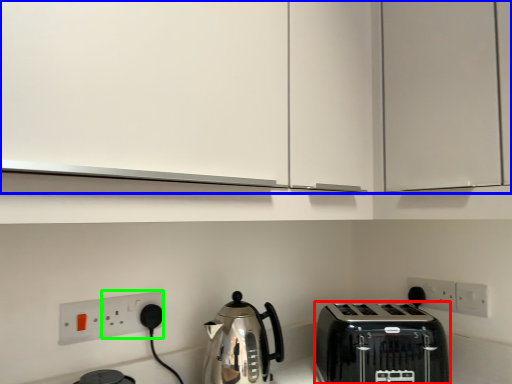
Question: Based on their relative distances, which object is nearer to toaster (highlighted by a red box)? Choose from cabinetry (highlighted by a blue box) and electric outlet (highlighted by a green box).

Choices:
 (A) cabinetry
 (B) electric outlet

Answer: (A)